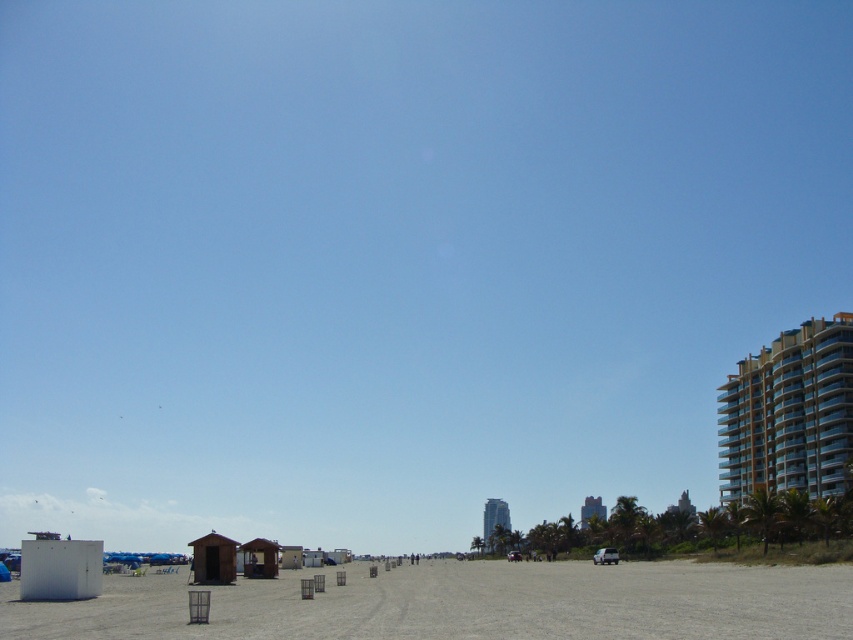
Question: Which point appears closest to the camera in this image?

Choices:
 (A) (218, 552)
 (B) (254, 538)

Answer: (A)

Question: Is white matte beach hut at lower left above wooden cabin at lower center?

Choices:
 (A) no
 (B) yes

Answer: (B)

Question: Observing the image, what is the correct spatial positioning of smooth sand beach at center in reference to white matte beach hut at lower left?

Choices:
 (A) left
 (B) right

Answer: (B)

Question: Estimate the real-world distances between objects in this image. Which object is closer to the white matte beach hut at lower left?

Choices:
 (A) smooth sand beach at center
 (B) wooden cabin at lower left
 (C) wooden cabin at lower center

Answer: (B)

Question: Which object is positioned closest to the wooden cabin at lower left?

Choices:
 (A) smooth sand beach at center
 (B) wooden cabin at lower center
 (C) white matte beach hut at lower left
 (D) metallic gold balcony at right

Answer: (B)

Question: Can you confirm if white matte beach hut at lower left is positioned below wooden cabin at lower center?

Choices:
 (A) no
 (B) yes

Answer: (A)